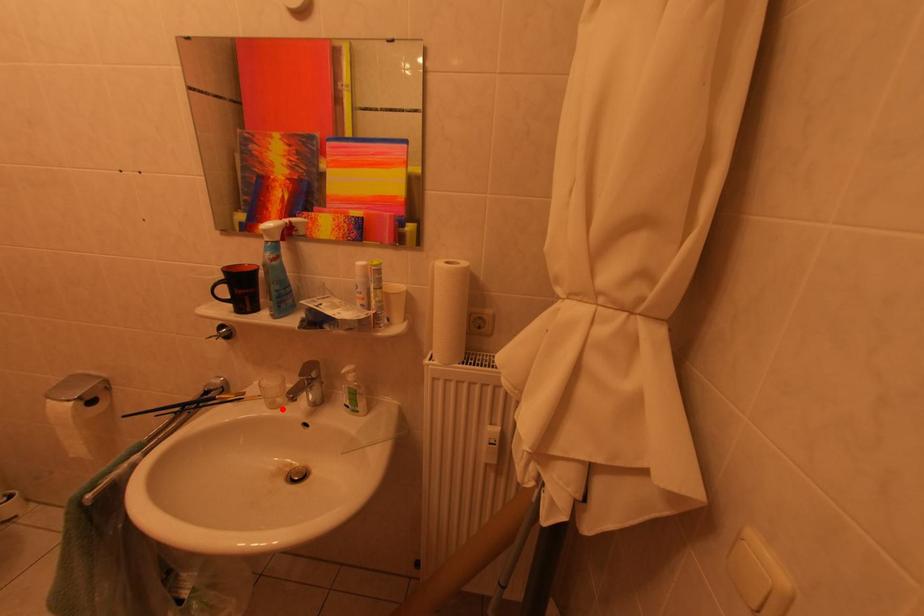
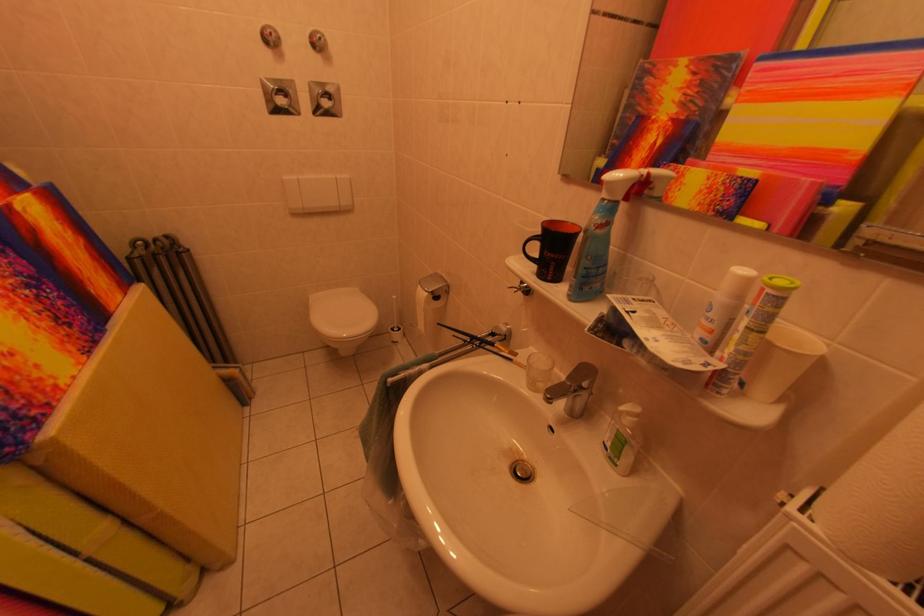
Where in the second image is the point corresponding to the highlighted location from the first image?

(541, 389)